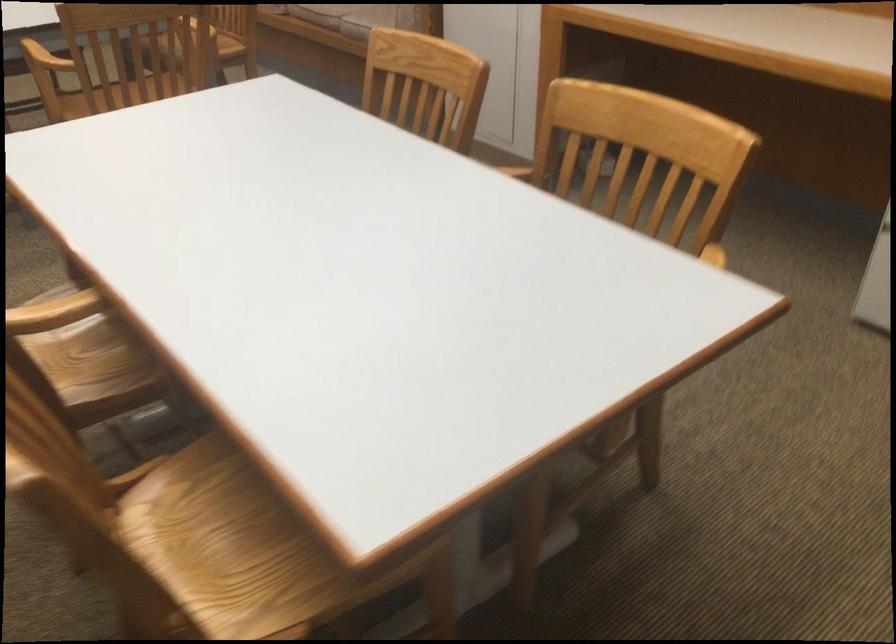
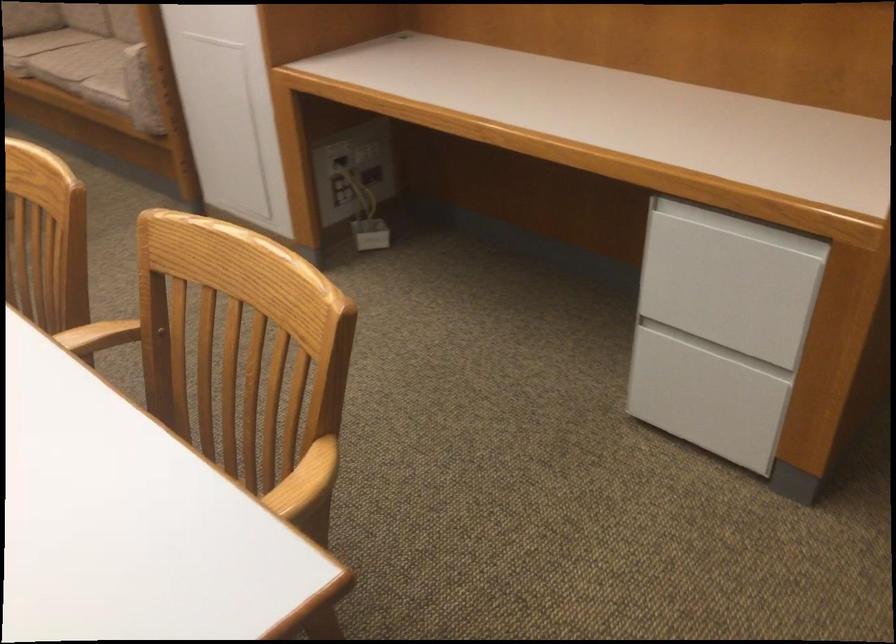
The point at [504,169] is marked in the first image. Where is the corresponding point in the second image?

(104, 335)